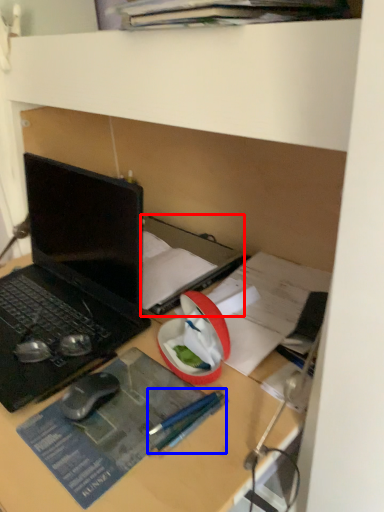
Question: Which of the following is the farthest to the observer, book (highlighted by a red box) or pencil (highlighted by a blue box)?

Choices:
 (A) book
 (B) pencil

Answer: (A)